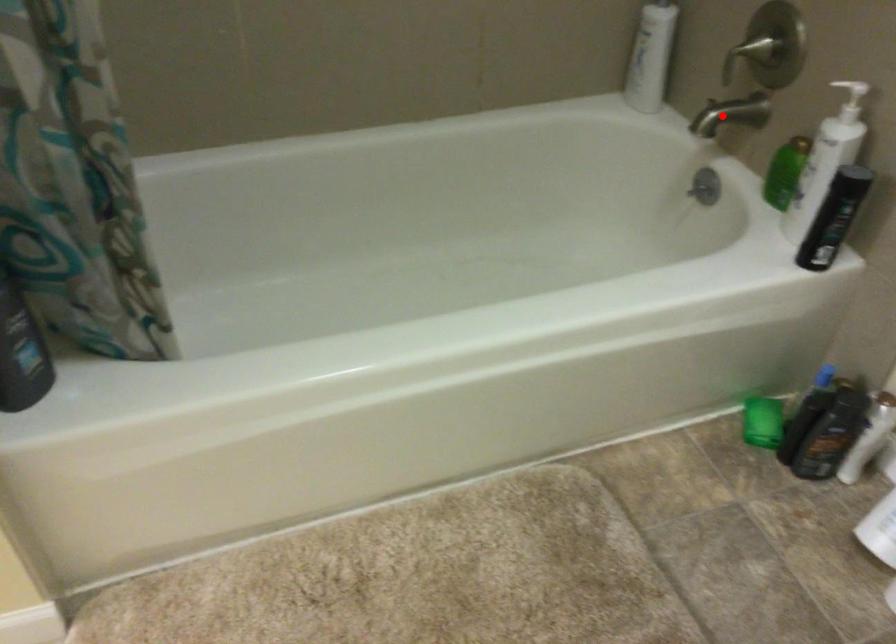
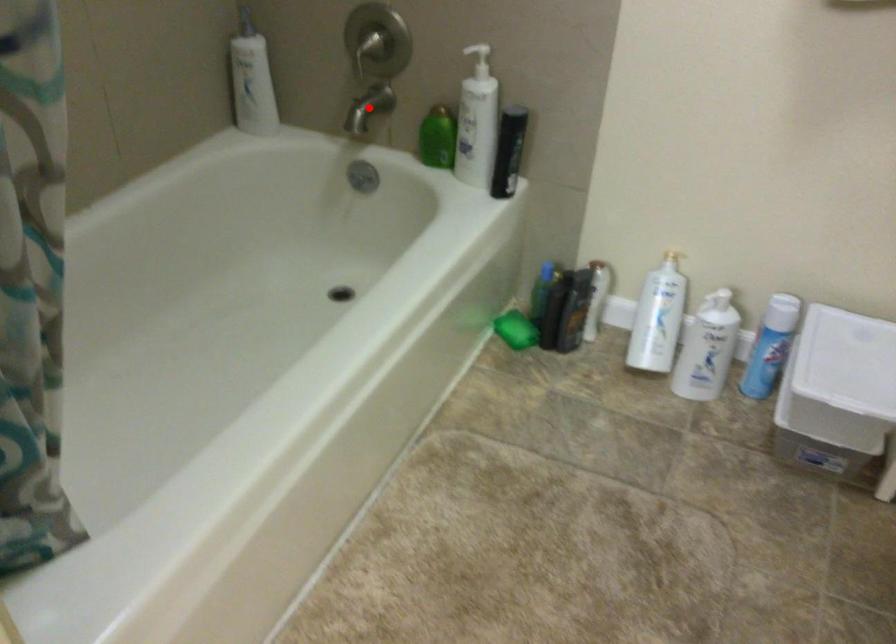
I am providing you with two images of the same scene from different viewpoints. A red point is marked on the first image and another point is marked on the second image. Do the highlighted points in image1 and image2 indicate the same real-world spot?

Yes